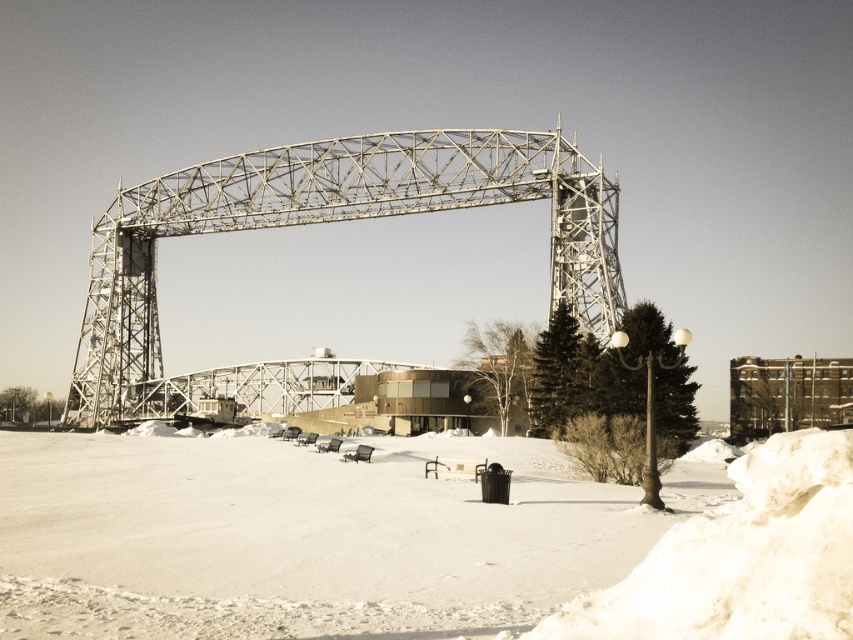
Question: Is white powdery snow at lower left smaller than metallic gray bridge at center?

Choices:
 (A) yes
 (B) no

Answer: (A)

Question: Considering the relative positions of white powdery snow at lower left and metallic gray bridge at center in the image provided, where is white powdery snow at lower left located with respect to metallic gray bridge at center?

Choices:
 (A) below
 (B) above

Answer: (A)

Question: Which point is farther to the camera?

Choices:
 (A) metallic gray bridge at center
 (B) white powdery snow at lower left

Answer: (A)

Question: Does white powdery snow at lower left appear under metallic gray bridge at center?

Choices:
 (A) no
 (B) yes

Answer: (B)

Question: Which point is closer to the camera?

Choices:
 (A) metallic gray bridge at center
 (B) white powdery snow at lower left

Answer: (B)